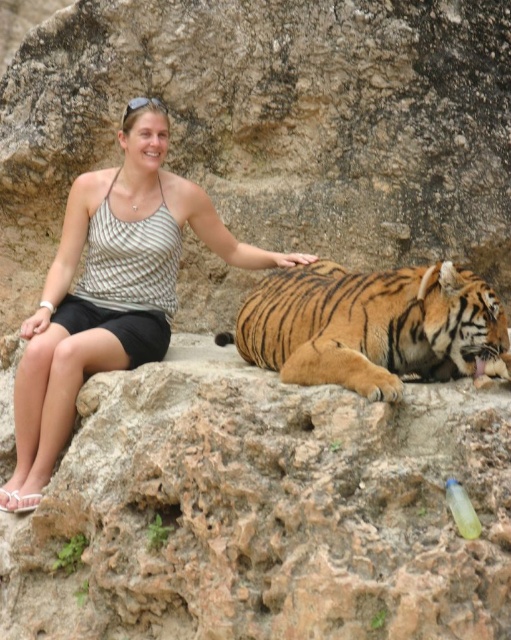
You are a zookeeper standing at the center of the image. You need to locate the orange striped tiger at lower right. According to the coordinates provided, in which direction should you move to reach the tiger?

The orange striped tiger at lower right is located at coordinates 0.511 on the x axis and 0.724 on the y axis. Since you are at the center of the image, which would be coordinates 0.5 on both axes, you should move slightly to the right along the x axis and upwards along the y axis to reach the tiger.

You are a photographer standing in front of the scene. You want to take a photo of the striped fabric tank top at center and the orange striped tiger at lower right. Which object will appear closer to you in the photo?

The striped fabric tank top at center will appear closer to you in the photo because it is positioned further to the viewer than the orange striped tiger at lower right.